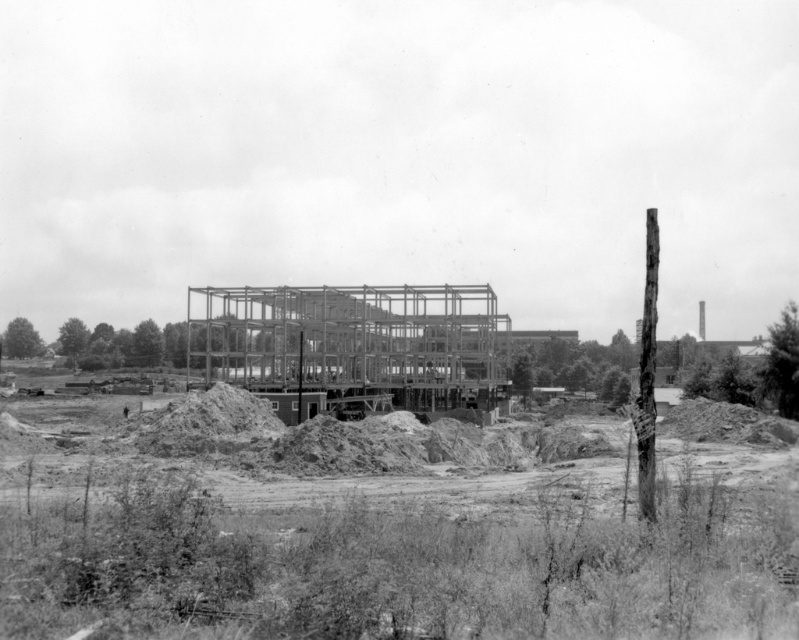
Question: Is dirt at center above metallic framework at center?

Choices:
 (A) no
 (B) yes

Answer: (A)

Question: Can you confirm if dirt at center is positioned to the left of metallic framework at center?

Choices:
 (A) yes
 (B) no

Answer: (B)

Question: Among these objects, which one is farthest from the camera?

Choices:
 (A) metallic framework at center
 (B) dirt at center

Answer: (A)

Question: Which point is farther to the camera?

Choices:
 (A) tap(277, 349)
 (B) tap(138, 518)

Answer: (A)

Question: Can you confirm if dirt at center is smaller than metallic framework at center?

Choices:
 (A) yes
 (B) no

Answer: (A)